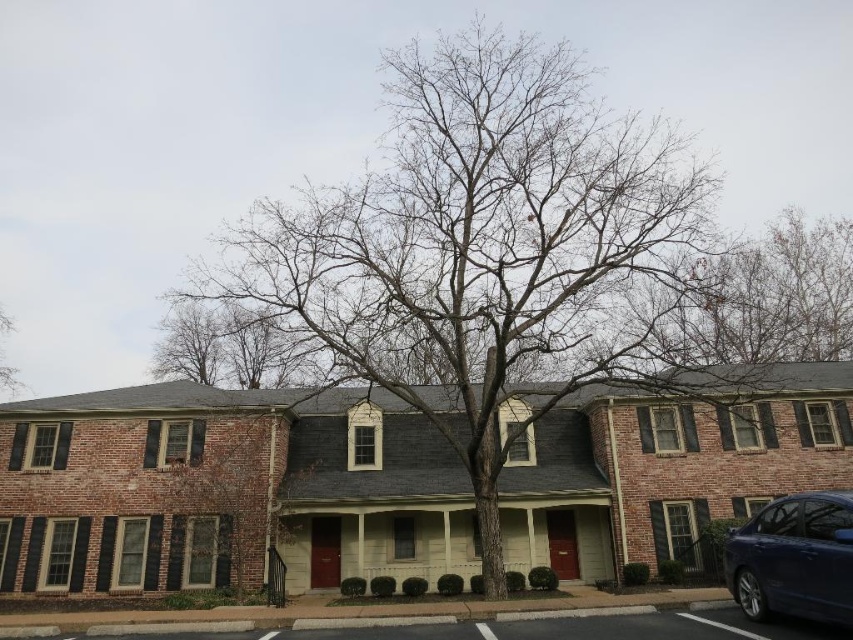
Question: Among these objects, which one is farthest from the camera?

Choices:
 (A) bare branches at center
 (B) shiny dark blue sedan at lower right

Answer: (A)

Question: Considering the relative positions of bare branches at center and shiny dark blue sedan at lower right in the image provided, where is bare branches at center located with respect to shiny dark blue sedan at lower right?

Choices:
 (A) left
 (B) right

Answer: (A)

Question: In this image, where is bare branches at center located relative to shiny dark blue sedan at lower right?

Choices:
 (A) right
 (B) left

Answer: (B)

Question: Which point is closer to the camera?

Choices:
 (A) shiny dark blue sedan at lower right
 (B) bare branches at center

Answer: (A)

Question: Does bare branches at center have a lesser width compared to shiny dark blue sedan at lower right?

Choices:
 (A) yes
 (B) no

Answer: (B)